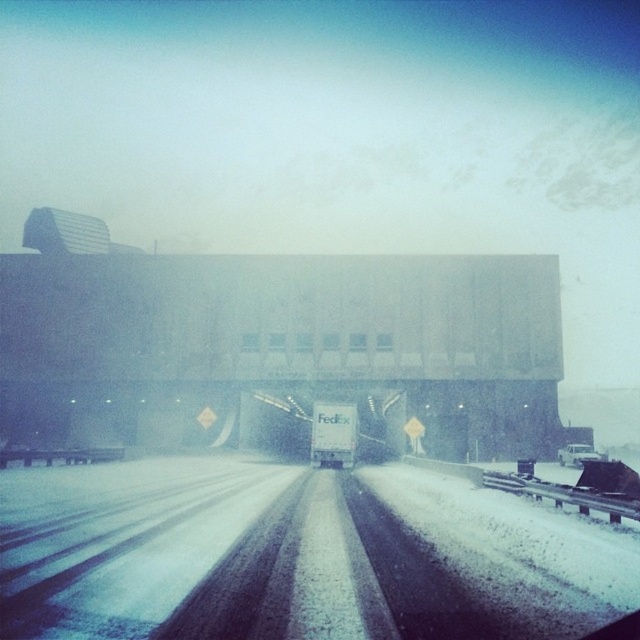
Can you confirm if white snow-covered highway at center is taller than white matte truck at center?

Yes, white snow-covered highway at center is taller than white matte truck at center.

How much distance is there between white snow-covered highway at center and white matte truck at center?

white snow-covered highway at center and white matte truck at center are 28.44 meters apart from each other.

Is point (403, 630) more distant than point (564, 448)?

No, (403, 630) is closer to viewer.

At what (x,y) coordinates should I click in order to perform the action: click on white snow-covered highway at center. Please return your answer as a coordinate pair (x, y). Image resolution: width=640 pixels, height=640 pixels. Looking at the image, I should click on (298, 556).